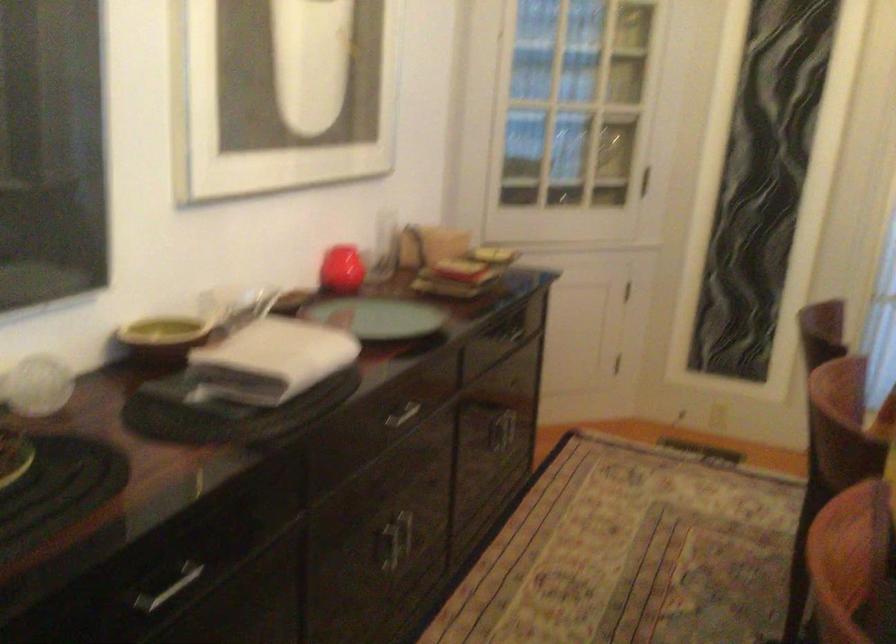
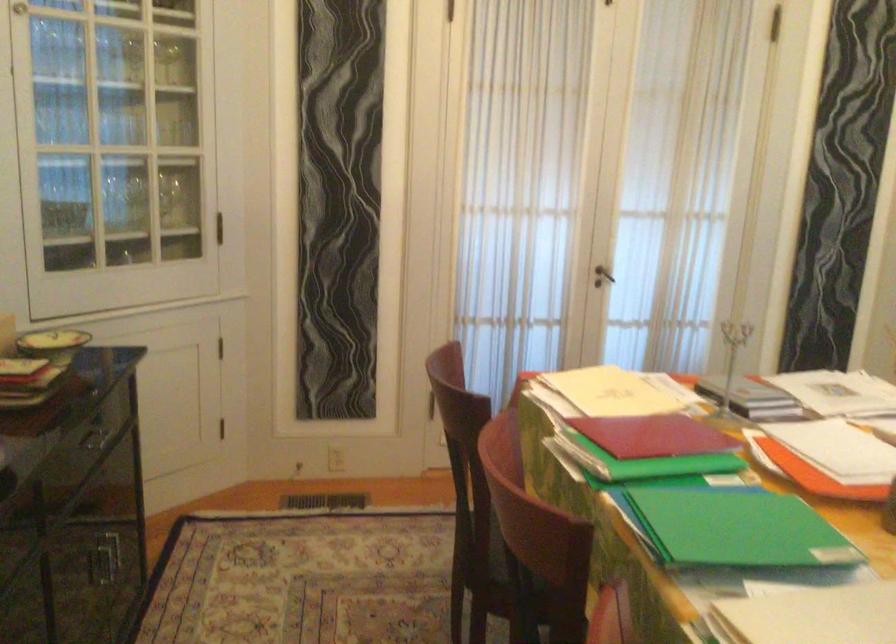
Question: The images are taken continuously from a first-person perspective. In which direction is your viewpoint rotating?

Choices:
 (A) Left
 (B) Right
 (C) Up
 (D) Down

Answer: (B)